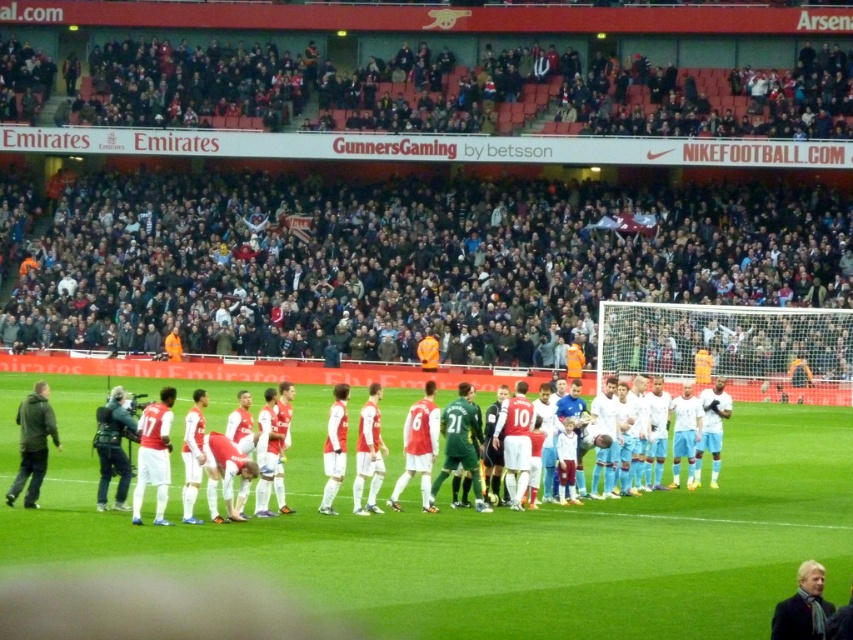
You are a photographer at the Emirates Stadium during a football match. You want to take a photo of the white smooth soccer team at center and the white wool scarf at lower right. Based on their positions, which object should you focus on first if you are standing at the center of the pitch?

The white smooth soccer team at center is to the left of the white wool scarf at lower right. Since you are standing at the center of the pitch, you should focus on the white smooth soccer team at center first as it is closer to your position compared to the scarf located at the lower right.

Consider the image. You are a photographer standing at the center of the Emirates Stadium pitch during a football match. You want to take a photo that includes both the point at coordinates point (25, 432) and point (97, 458). Which point should you focus on first to ensure both are in sharp focus?

You should focus on point (25, 432) first because it is closer to you than point (97, 458), ensuring both points are within the depth of field.